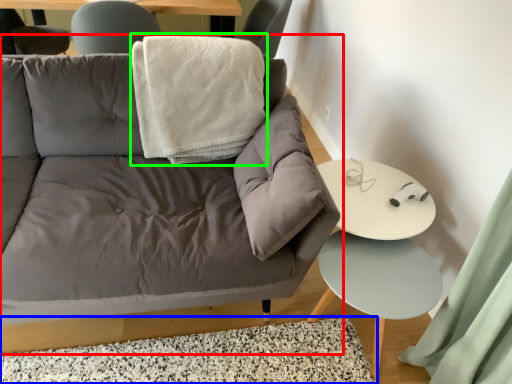
Question: Which object is positioned farthest from studio couch (highlighted by a red box)? Select from mat (highlighted by a blue box) and blanket (highlighted by a green box).

Choices:
 (A) mat
 (B) blanket

Answer: (B)